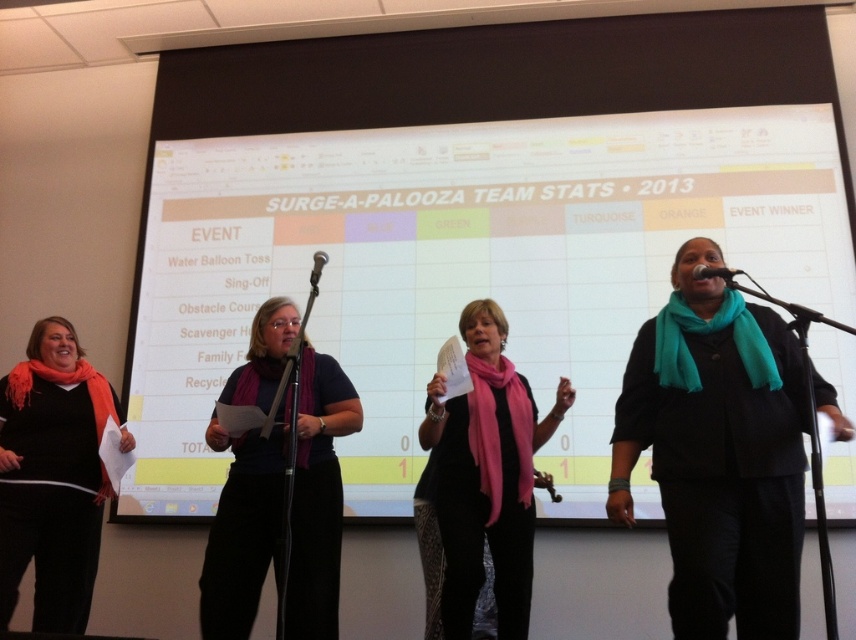
You are a photographer standing in front of the stage. You want to take a closeup of the purple scarf at center. Which direction should you move to get a better shot?

To take a closeup of the purple scarf at center, you should move forward towards the stage since the scarf is located at the center of the scene.

You are a photographer standing at the back of the stage. You want to take a photo that includes both the orange scarf at left and the large screen behind the team. Is there enough space between them for both to fit in the frame?

The orange scarf at left and the large screen are 3.03 meters apart. Since the photographer is at the back, this distance should allow both to be captured in the frame as they are separated sufficiently.